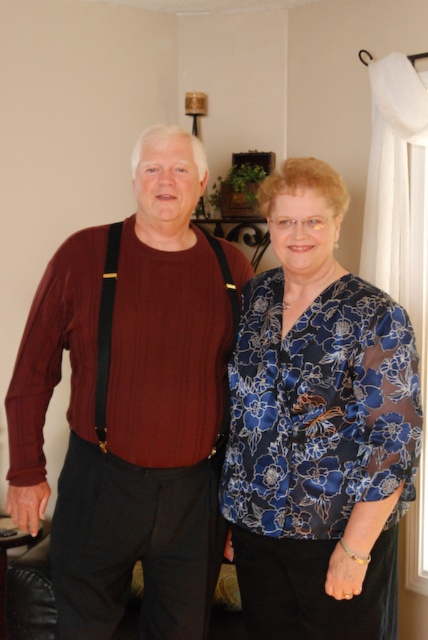
Question: Among these objects, which one is farthest from the camera?

Choices:
 (A) blue satin blouse at center
 (B) corduroy sweater at center

Answer: (B)

Question: In this image, where is corduroy sweater at center located relative to blue satin blouse at center?

Choices:
 (A) above
 (B) below

Answer: (A)

Question: Which point is farther to the camera?

Choices:
 (A) corduroy sweater at center
 (B) blue satin blouse at center

Answer: (A)

Question: Can you confirm if corduroy sweater at center is wider than blue satin blouse at center?

Choices:
 (A) yes
 (B) no

Answer: (A)

Question: Can you confirm if corduroy sweater at center is positioned to the left of blue satin blouse at center?

Choices:
 (A) no
 (B) yes

Answer: (B)